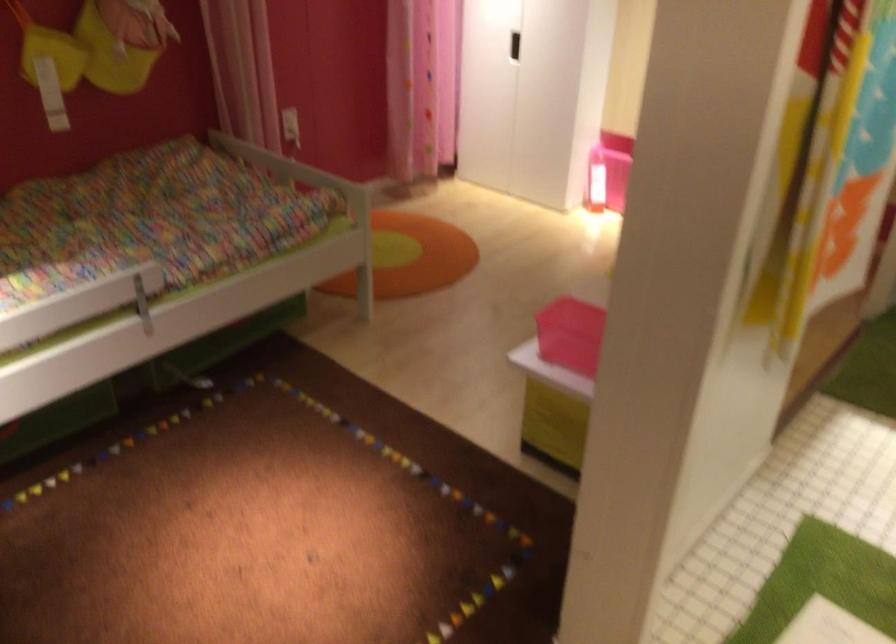
Identify the location of dark wardrobe handle. This screenshot has height=644, width=896. (514, 46).